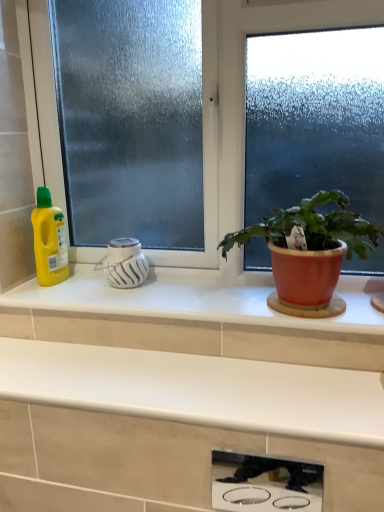
Find the location of a particular element. The height and width of the screenshot is (512, 384). free space in front of yellow plastic bottle at left is located at coordinates (44, 298).